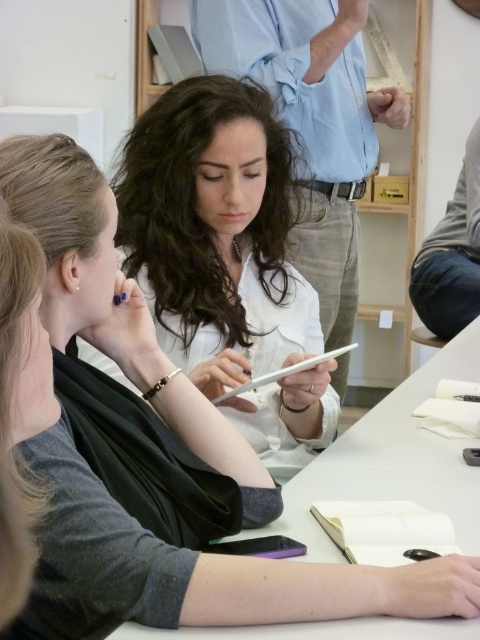
Is white matte tablet at center further to camera compared to white matte table at center?

That is True.

Can you confirm if white matte tablet at center is positioned to the right of white matte table at center?

In fact, white matte tablet at center is to the left of white matte table at center.

Is point (170, 209) farther from viewer compared to point (416, 500)?

Yes, it is.

Image resolution: width=480 pixels, height=640 pixels. What are the coordinates of `white matte tablet at center` in the screenshot? It's located at (216, 232).